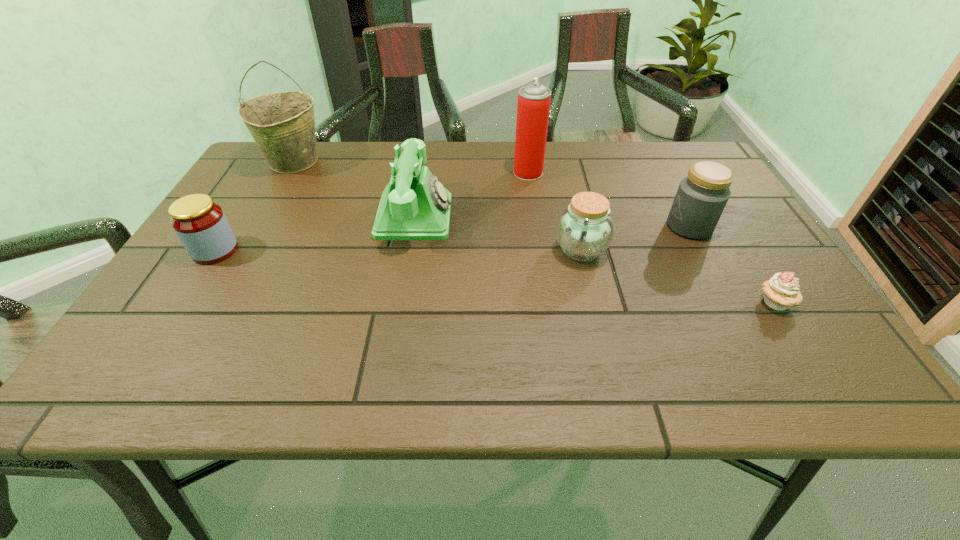
Point out which jar is positioned as the nearest to the second jar from right to left. Please provide its 2D coordinates. Your answer should be formatted as a tuple, i.e. [(x, y)], where the tuple contains the x and y coordinates of a point satisfying the conditions above.

[(701, 197)]

The image size is (960, 540). In order to click on vacant point that satisfies the following two spatial constraints: 1. on the back side of the nearest object; 2. on the dial of the third object from left to right in this screenshot , I will do `click(721, 217)`.

This screenshot has width=960, height=540. I want to click on free space that satisfies the following two spatial constraints: 1. on the front side of the aerosol can; 2. on the dial of the telephone, so click(x=535, y=217).

You are a GUI agent. You are given a task and a screenshot of the screen. Output one action in this format:
    pyautogui.click(x=<x>, y=<y>)
    Task: Click on the vacant region that satisfies the following two spatial constraints: 1. on the back side of the cupcake; 2. on the dial of the telephone
    
    Given the screenshot: What is the action you would take?
    pyautogui.click(x=721, y=217)

Where is `free space in the image that satisfies the following two spatial constraints: 1. on the front side of the aerosol can; 2. on the right side of the wine bucket`? The image size is (960, 540). free space in the image that satisfies the following two spatial constraints: 1. on the front side of the aerosol can; 2. on the right side of the wine bucket is located at coordinates (288, 173).

Image resolution: width=960 pixels, height=540 pixels. In order to click on vacant space that satisfies the following two spatial constraints: 1. on the dial of the telephone; 2. on the left side of the shortest object in this screenshot , I will do `click(400, 302)`.

Find the location of a particular element. This screenshot has width=960, height=540. vacant area in the image that satisfies the following two spatial constraints: 1. on the dial of the second jar from left to right; 2. on the left side of the third object from left to right is located at coordinates (409, 250).